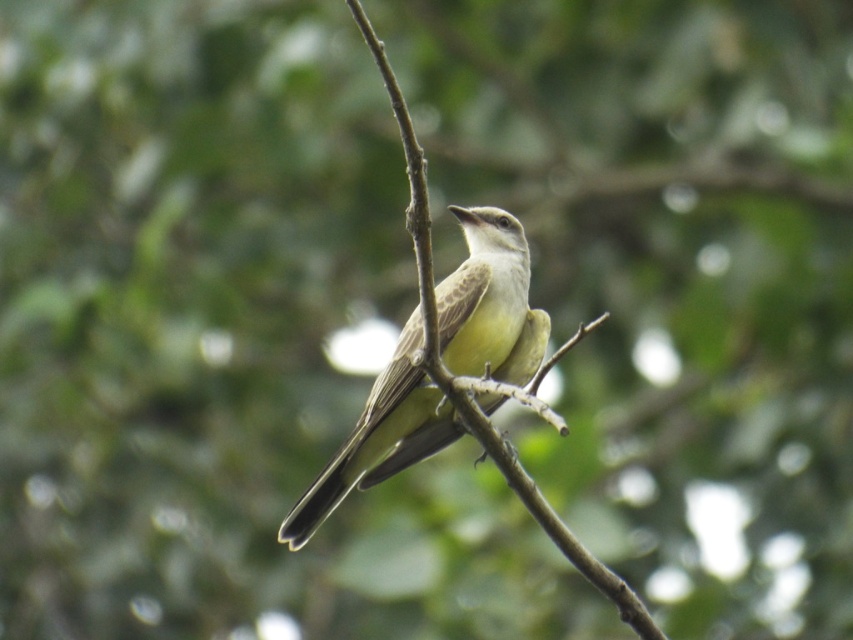
Question: Does light brown feathers at center have a larger size compared to brown wood tree branch at center?

Choices:
 (A) no
 (B) yes

Answer: (A)

Question: Does light brown feathers at center have a larger size compared to brown wood tree branch at center?

Choices:
 (A) yes
 (B) no

Answer: (B)

Question: Which object appears closest to the camera in this image?

Choices:
 (A) light brown feathers at center
 (B) brown wood tree branch at center

Answer: (B)

Question: Does light brown feathers at center have a smaller size compared to brown wood tree branch at center?

Choices:
 (A) no
 (B) yes

Answer: (B)